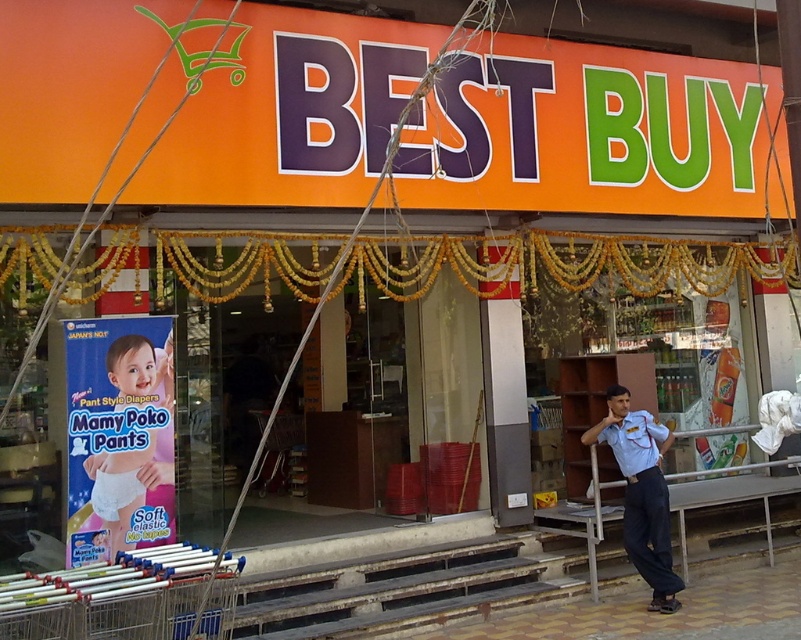
In the scene shown: You are a delivery person standing at the entrance of the BEST BUY store. You need to place a package in a location that is exactly 4 meters away from both the light blue uniform at center and the soft plastic diaper at lower left. Is this possible?

The distance between the light blue uniform at center and the soft plastic diaper at lower left is 4.36 meters. Since 4 meters is less than the total distance between them, it is possible to place the package exactly 4 meters away from both objects.

You are a customer standing in front of the BEST BUY store entrance. You see a point marked at coordinates (x=641, y=492). What object is located at that point?

The point at coordinates (x=641, y=492) marks the location of the light blue uniform at center.

Based on the photo, you are a customer entering the BEST BUY store and see the light blue uniform at center and the soft plastic diaper at lower left. Which object is taller?

The light blue uniform at center is much taller than the soft plastic diaper at lower left.